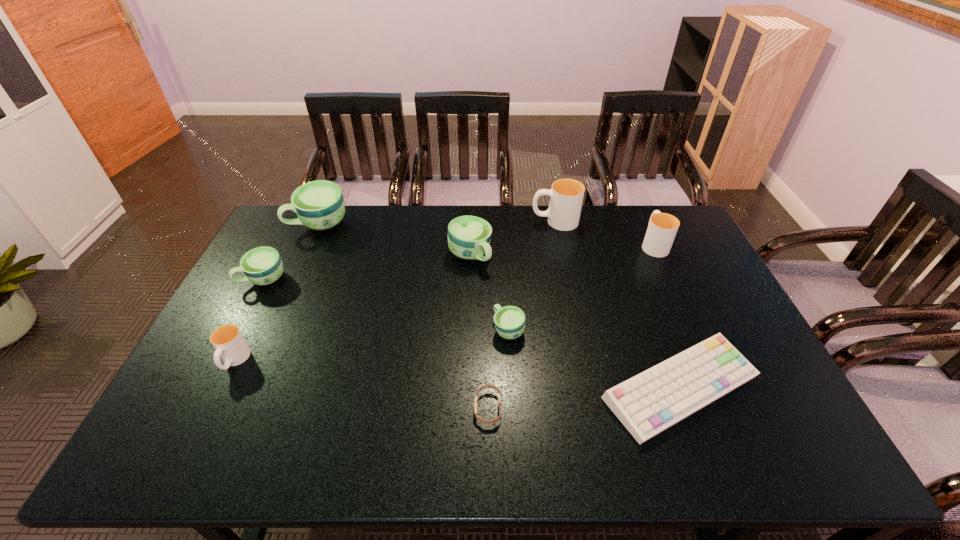
The height and width of the screenshot is (540, 960). I want to click on free region at the near left corner, so click(185, 451).

Where is `free space between the farthest yellow cup and the farthest blue cup`? free space between the farthest yellow cup and the farthest blue cup is located at coordinates (437, 222).

The width and height of the screenshot is (960, 540). In order to click on vacant space that's between the second smallest blue cup and the white computer keyboard in this screenshot , I will do `click(472, 334)`.

The height and width of the screenshot is (540, 960). I want to click on free space between the second nearest yellow cup and the second smallest blue cup, so click(459, 261).

Identify the location of free space between the biggest blue cup and the smallest blue cup. (414, 276).

The image size is (960, 540). Identify the location of vacant area between the third smallest blue cup and the computer keyboard. (575, 322).

Find the location of `blank region between the computer keyboard and the second cup from right to left`. blank region between the computer keyboard and the second cup from right to left is located at coordinates (617, 305).

You are a GUI agent. You are given a task and a screenshot of the screen. Output one action in this format:
    pyautogui.click(x=<x>, y=<y>)
    Task: Click on the free space between the watch and the second nearest yellow cup
    
    Given the screenshot: What is the action you would take?
    pyautogui.click(x=571, y=326)

The height and width of the screenshot is (540, 960). In order to click on vacant point located between the second shortest object and the nearest blue cup in this screenshot , I will do `click(594, 359)`.

At what (x,y) coordinates should I click in order to perform the action: click on empty location between the nearest blue cup and the shortest object. Please return your answer as a coordinate pair (x, y). Looking at the image, I should click on (498, 369).